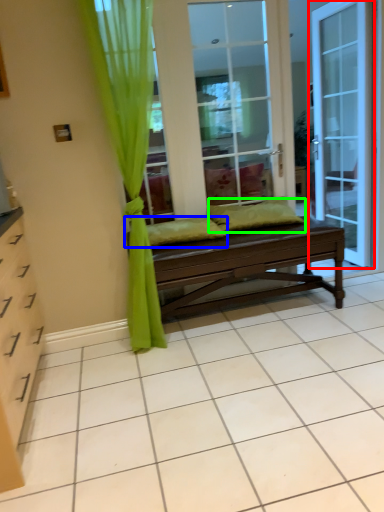
Question: Which object is positioned closest to door (highlighted by a red box)? Select from pillow (highlighted by a blue box) and pillow (highlighted by a green box).

Choices:
 (A) pillow
 (B) pillow

Answer: (B)